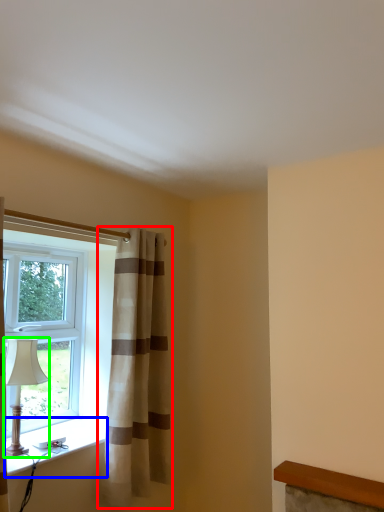
Question: Which object is positioned closest to curtain (highlighted by a red box)? Select from window sill (highlighted by a blue box) and table lamp (highlighted by a green box).

Choices:
 (A) window sill
 (B) table lamp

Answer: (A)